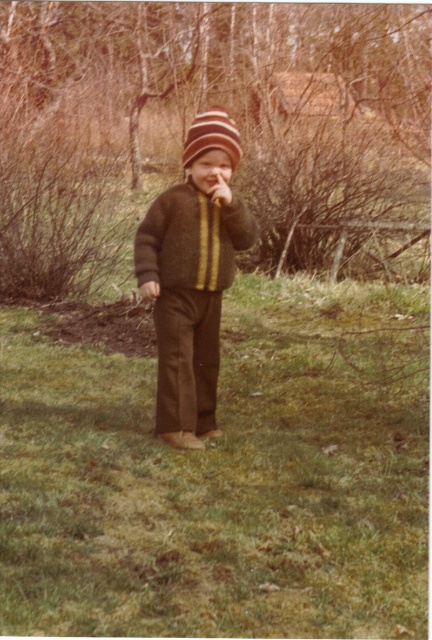
Question: Is knitted brown sweater at center below matte brown nose at center?

Choices:
 (A) yes
 (B) no

Answer: (A)

Question: Is striped woolen hat at center closer to camera compared to matte brown hand at center?

Choices:
 (A) no
 (B) yes

Answer: (A)

Question: Which is farther from the green grass at center?

Choices:
 (A) striped woolen hat at center
 (B) knitted brown sweater at center
 (C) matte brown hand at center

Answer: (A)

Question: Can you confirm if green grass at center is positioned to the left of matte brown nose at center?

Choices:
 (A) yes
 (B) no

Answer: (B)

Question: Which object appears farthest from the camera in this image?

Choices:
 (A) matte brown hand at center
 (B) matte brown nose at center

Answer: (B)

Question: Which object appears closest to the camera in this image?

Choices:
 (A) matte brown nose at center
 (B) striped woolen hat at center

Answer: (B)